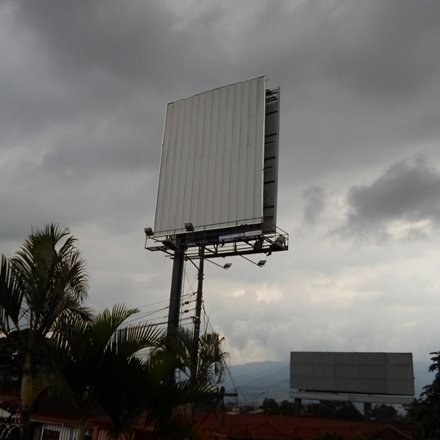
Locate an element on the screen. window is located at coordinates (52, 434).